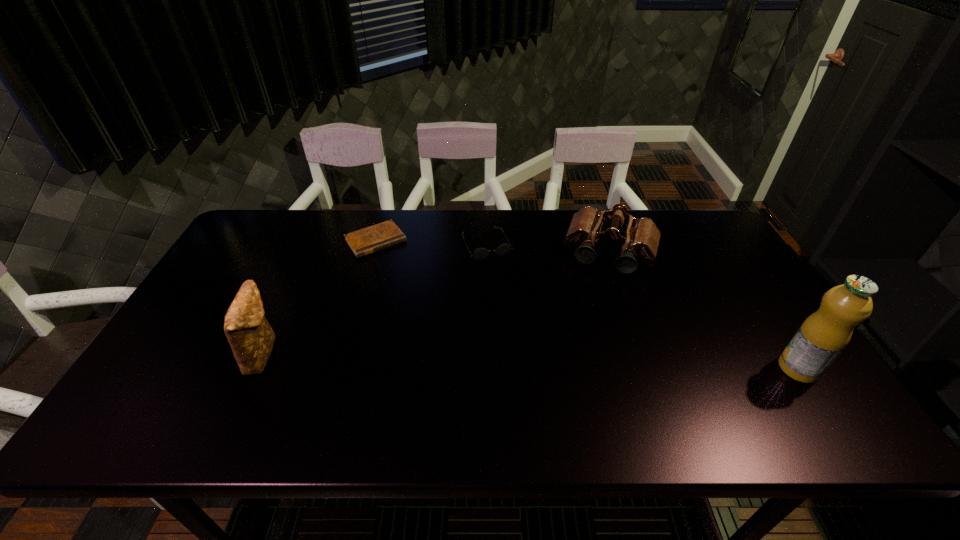
Where is `free point located 0.200m through the eyepieces of the binoculars`? The image size is (960, 540). free point located 0.200m through the eyepieces of the binoculars is located at coordinates (587, 327).

Image resolution: width=960 pixels, height=540 pixels. I want to click on free region located 0.330m through the eyepieces of the binoculars, so click(576, 364).

This screenshot has height=540, width=960. I want to click on free location located through the eyepieces of the binoculars, so click(x=589, y=316).

Find the location of a particular element. The image size is (960, 540). sunglasses at the far edge is located at coordinates (480, 254).

Identify the location of diary that is positioned at the far edge. This screenshot has height=540, width=960. (362, 242).

The height and width of the screenshot is (540, 960). In order to click on binoculars at the far edge in this screenshot , I will do (641, 239).

The width and height of the screenshot is (960, 540). Find the location of `clutch bag positioned at the near edge`. clutch bag positioned at the near edge is located at coordinates (249, 334).

Locate an element on the screen. fruit juice at the near edge is located at coordinates (820, 339).

Locate an element on the screen. Image resolution: width=960 pixels, height=540 pixels. object that is at the right edge is located at coordinates (820, 339).

Image resolution: width=960 pixels, height=540 pixels. In order to click on object that is at the near right corner in this screenshot , I will do `click(820, 339)`.